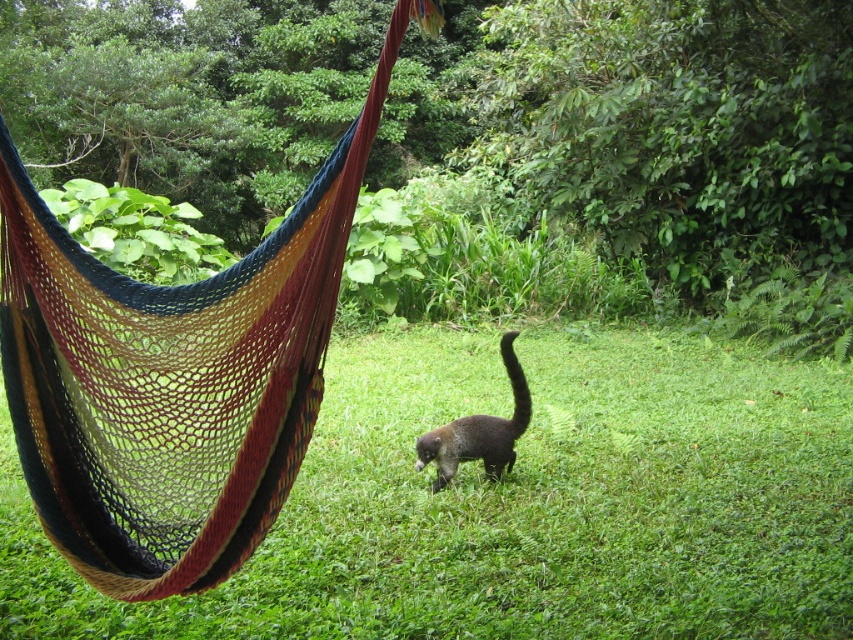
You are a photographer trying to capture both the brown furry cat at center and the brown fuzzy tail at center in a single shot. Since the camera can only focus on one subject at a time, which subject should you focus on to ensure the other is still in the frame?

The brown furry cat at center is bigger than the brown fuzzy tail at center, so focusing on the brown furry cat at center will ensure the brown fuzzy tail at center remains in the frame.

You are standing at the origin point of the image. Which direction should you move to reach the green grass at center?

The green grass at center is located at coordinates point [521,502], so you should move towards the center of the image to reach it.